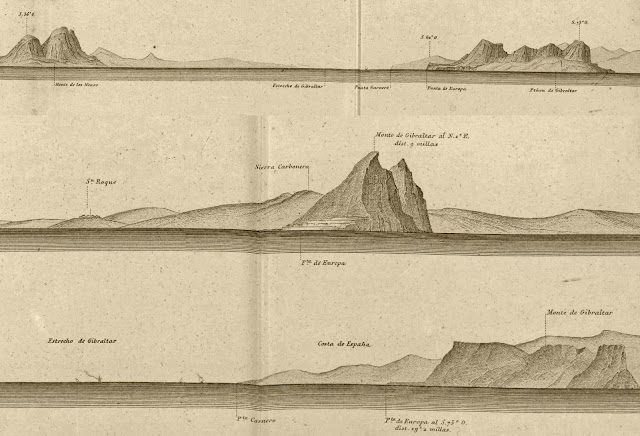
At what (x,y) coordinates should I click in order to perform the action: click on stairs. Please return your answer as a coordinate pair (x, y). This screenshot has width=640, height=436. Looking at the image, I should click on (317, 226), (326, 223), (346, 217), (337, 220), (454, 69).